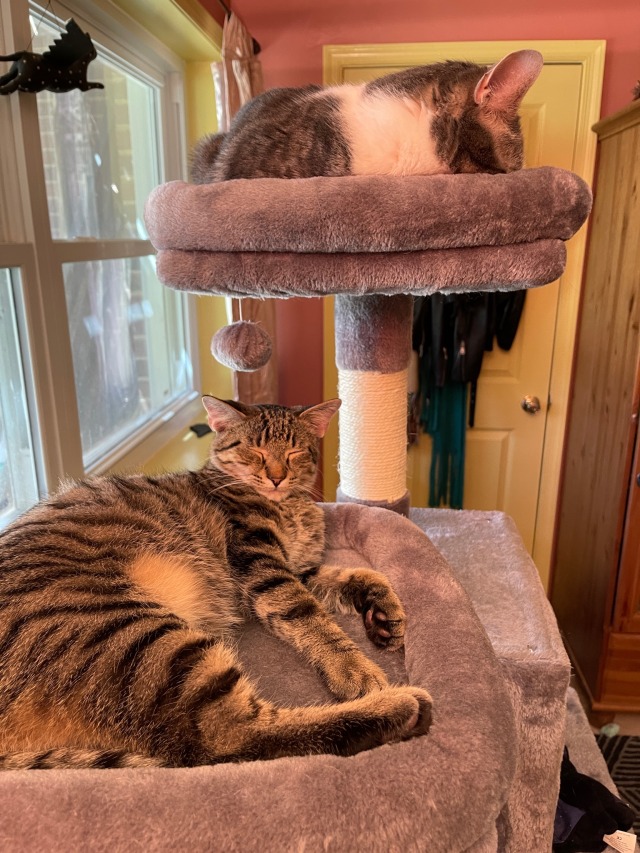
At what (x,y) coordinates should I click in order to perform the action: click on ball hanging from cat tower. Please return your answer as a coordinate pair (x, y). Looking at the image, I should click on (241, 346).